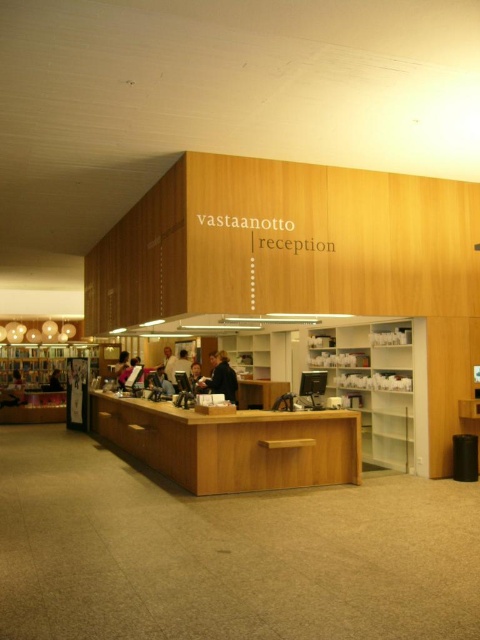
Question: Which is nearer to the light brown wooden desk at center?

Choices:
 (A) light brown hair at center
 (B) white wood bookshelf at right
 (C) light brown leather jacket at center

Answer: (B)

Question: Which point is farther from the camera taking this photo?

Choices:
 (A) (228, 388)
 (B) (301, 458)
 (C) (52, 372)

Answer: (C)

Question: Can you confirm if dark blue jacket at center is positioned to the right of matte black person at lower left?

Choices:
 (A) yes
 (B) no

Answer: (A)

Question: Does light brown leather jacket at center have a greater width compared to light brown hair at center?

Choices:
 (A) yes
 (B) no

Answer: (B)

Question: Which object is the closest to the light brown hair at center?

Choices:
 (A) white wood bookshelf at right
 (B) dark blue jacket at center

Answer: (B)

Question: Does white wood bookshelf at right have a lesser width compared to light brown hair at center?

Choices:
 (A) yes
 (B) no

Answer: (B)